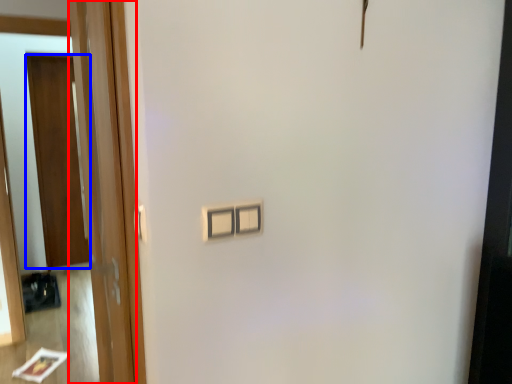
Question: Which point is closer to the camera, door (highlighted by a red box) or door (highlighted by a blue box)?

Choices:
 (A) door
 (B) door

Answer: (A)